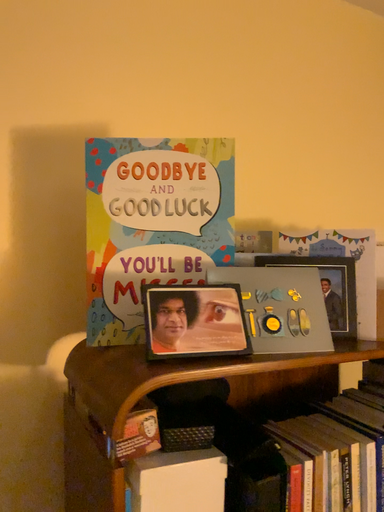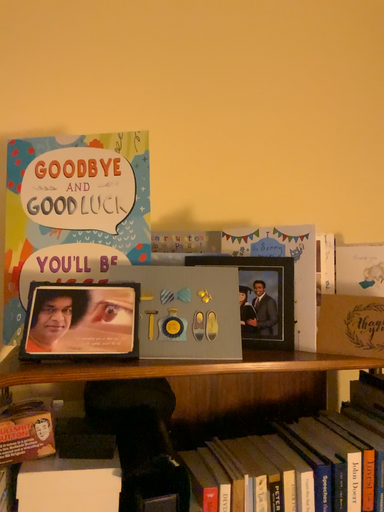
Question: How did the camera likely rotate when shooting the video?

Choices:
 (A) rotated right
 (B) rotated left

Answer: (B)